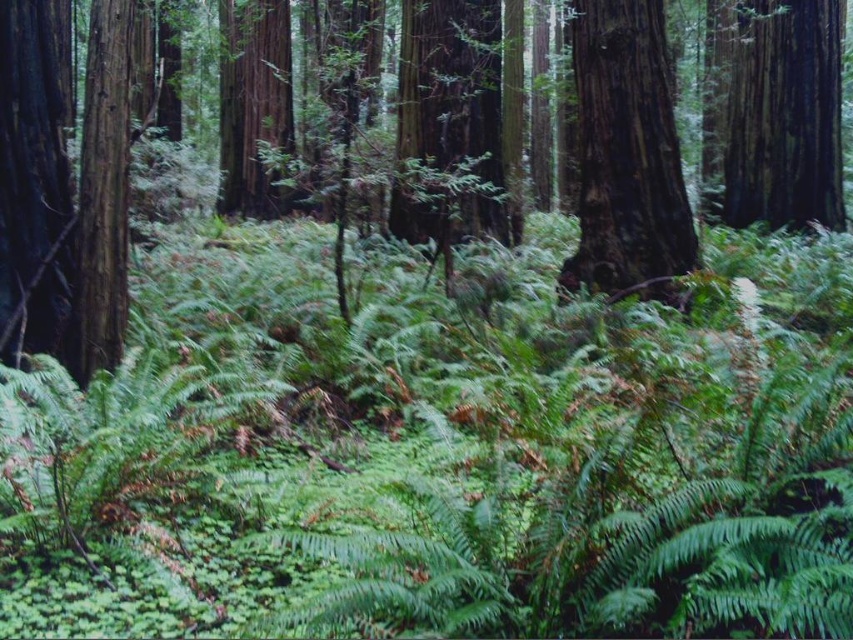
Question: Is smooth bark tree at center below smooth dark brown tree trunk at upper right?

Choices:
 (A) no
 (B) yes

Answer: (B)

Question: Which of the following is the closest to the observer?

Choices:
 (A) (x=640, y=40)
 (B) (x=624, y=209)
 (C) (x=808, y=147)

Answer: (A)

Question: Which point is closer to the camera?

Choices:
 (A) smooth dark brown tree trunk at upper right
 (B) smooth bark tree at center
 (C) smooth dark brown tree trunk at center

Answer: (B)

Question: Which object appears closest to the camera in this image?

Choices:
 (A) smooth dark brown tree trunk at upper right
 (B) smooth bark tree at center
 (C) smooth dark brown tree trunk at center

Answer: (B)

Question: Can you confirm if smooth bark tree at center is thinner than smooth dark brown tree trunk at upper right?

Choices:
 (A) no
 (B) yes

Answer: (A)

Question: Considering the relative positions of smooth dark brown tree trunk at center and smooth dark brown tree trunk at upper right in the image provided, where is smooth dark brown tree trunk at center located with respect to smooth dark brown tree trunk at upper right?

Choices:
 (A) above
 (B) below

Answer: (B)